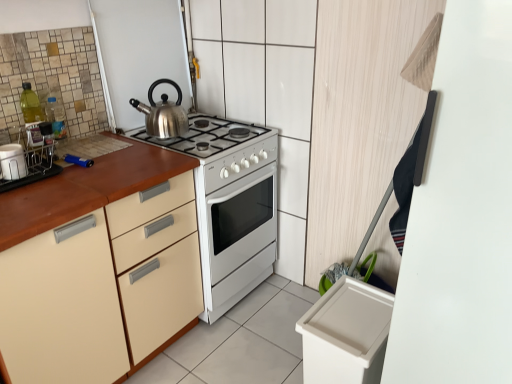
Locate an element on the screen. The image size is (512, 384). matte white container at left is located at coordinates click(12, 162).

The width and height of the screenshot is (512, 384). Describe the element at coordinates (102, 288) in the screenshot. I see `matte wood cabinet at left` at that location.

The width and height of the screenshot is (512, 384). What do you see at coordinates (163, 113) in the screenshot?
I see `satin silver kettle at upper center` at bounding box center [163, 113].

At what (x,y) coordinates should I click in order to perform the action: click on matte white container at left. Please return your answer as a coordinate pair (x, y). Looking at the image, I should click on (12, 162).

Is white glossy stove at center facing towards matte wood cabinet at left?

No.

Is white glossy stove at center positioned behind matte wood cabinet at left?

That is True.

From a real-world perspective, which is physically below, white glossy stove at center or matte wood cabinet at left?

white glossy stove at center.

Is white glossy stove at center wider than matte wood cabinet at left?

Indeed, white glossy stove at center has a greater width compared to matte wood cabinet at left.

How far apart are satin silver kettle at upper center and white glossy stove at center?

The distance of satin silver kettle at upper center from white glossy stove at center is 15.13 inches.

From a real-world perspective, is satin silver kettle at upper center below white glossy stove at center?

No, from a real-world perspective, satin silver kettle at upper center is not under white glossy stove at center.

Is satin silver kettle at upper center wider than white glossy stove at center?

No.

Where is `kettle above the white glossy stove at center (from a real-world perspective)`? This screenshot has width=512, height=384. kettle above the white glossy stove at center (from a real-world perspective) is located at coordinates (163, 113).

Is matte wood cabinet at left far from white glossy stove at center?

No, matte wood cabinet at left is in close proximity to white glossy stove at center.

In terms of size, does matte wood cabinet at left appear bigger or smaller than white glossy stove at center?

In the image, matte wood cabinet at left appears to be larger than white glossy stove at center.

How many degrees apart are the facing directions of matte wood cabinet at left and white glossy stove at center?

There is a 3.59e-05-degree angle between the facing directions of matte wood cabinet at left and white glossy stove at center.

Is matte wood cabinet at left oriented away from white glossy stove at center?

No, matte wood cabinet at left is not facing away from white glossy stove at center.

Are satin silver kettle at upper center and matte wood cabinet at left making contact?

No, satin silver kettle at upper center is not making contact with matte wood cabinet at left.

Is point (164, 118) more distant than point (190, 194)?

Yes, point (164, 118) is behind point (190, 194).

Is satin silver kettle at upper center bigger or smaller than matte wood cabinet at left?

Clearly, satin silver kettle at upper center is smaller in size than matte wood cabinet at left.

Which object is positioned more to the right, satin silver kettle at upper center or matte wood cabinet at left?

Positioned to the right is satin silver kettle at upper center.

Does matte white container at left have a greater width compared to white glossy stove at center?

Incorrect, the width of matte white container at left does not surpass that of white glossy stove at center.

From the image's perspective, does matte white container at left appear lower than white glossy stove at center?

Incorrect, from the image's perspective, matte white container at left is higher than white glossy stove at center.

Locate an element on the screen. Image resolution: width=512 pixels, height=384 pixels. kitchen appliance in front of the white glossy stove at center is located at coordinates (12, 162).

Which object is positioned more to the right, matte white container at left or matte wood cabinet at left?

matte wood cabinet at left is more to the right.

Is matte white container at left far from matte wood cabinet at left?

matte white container at left is near matte wood cabinet at left, not far away.

From the image's perspective, which one is positioned higher, matte white container at left or matte wood cabinet at left?

matte white container at left appears higher in the image.

Is matte white container at left behind matte wood cabinet at left?

Yes, matte white container at left is further from the camera.

In terms of height, does satin silver kettle at upper center look taller or shorter compared to matte white container at left?

Clearly, satin silver kettle at upper center is taller compared to matte white container at left.

From a real-world perspective, is satin silver kettle at upper center below matte white container at left?

No, from a real-world perspective, satin silver kettle at upper center is not under matte white container at left.

Is the depth of satin silver kettle at upper center greater than that of matte white container at left?

Yes, it is.

Locate an element on the screen. The image size is (512, 384). cabinetry below the white glossy stove at center (from the image's perspective) is located at coordinates (102, 288).

The image size is (512, 384). What are the coordinates of `appliance behind the satin silver kettle at upper center` in the screenshot? It's located at (231, 205).

Consider the image. Estimate the real-world distances between objects in this image. Which object is further from matte wood cabinet at left, white glossy stove at center or matte white container at left?

matte white container at left lies further to matte wood cabinet at left than the other object.

Which object lies further to the anchor point satin silver kettle at upper center, matte white container at left or white glossy stove at center?

matte white container at left.

Based on their spatial positions, is matte white container at left or white glossy stove at center further from matte wood cabinet at left?

matte white container at left is further to matte wood cabinet at left.

Which object lies nearer to the anchor point satin silver kettle at upper center, white glossy stove at center or matte white container at left?

Based on the image, white glossy stove at center appears to be nearer to satin silver kettle at upper center.

From the image, which object appears to be farther from matte wood cabinet at left, matte white container at left or satin silver kettle at upper center?

Among the two, satin silver kettle at upper center is located further to matte wood cabinet at left.

From the image, which object appears to be nearer to matte wood cabinet at left, white glossy stove at center or satin silver kettle at upper center?

Among the two, white glossy stove at center is located nearer to matte wood cabinet at left.

Considering their positions, is satin silver kettle at upper center positioned closer to matte wood cabinet at left than white glossy stove at center?

white glossy stove at center.

Which object lies nearer to the anchor point matte wood cabinet at left, satin silver kettle at upper center or matte white container at left?

The object closer to matte wood cabinet at left is matte white container at left.

At what (x,y) coordinates should I click in order to perform the action: click on kitchen appliance located between matte wood cabinet at left and white glossy stove at center in the depth direction. Please return your answer as a coordinate pair (x, y). Image resolution: width=512 pixels, height=384 pixels. Looking at the image, I should click on point(12,162).

The height and width of the screenshot is (384, 512). What are the coordinates of `kitchen appliance between satin silver kettle at upper center and matte wood cabinet at left in the vertical direction` in the screenshot? It's located at (12, 162).

Where is `appliance that lies between satin silver kettle at upper center and matte wood cabinet at left from top to bottom`? The image size is (512, 384). appliance that lies between satin silver kettle at upper center and matte wood cabinet at left from top to bottom is located at coordinates (x=231, y=205).

Where is `kettle located between matte white container at left and white glossy stove at center in the left-right direction`? kettle located between matte white container at left and white glossy stove at center in the left-right direction is located at coordinates 163,113.